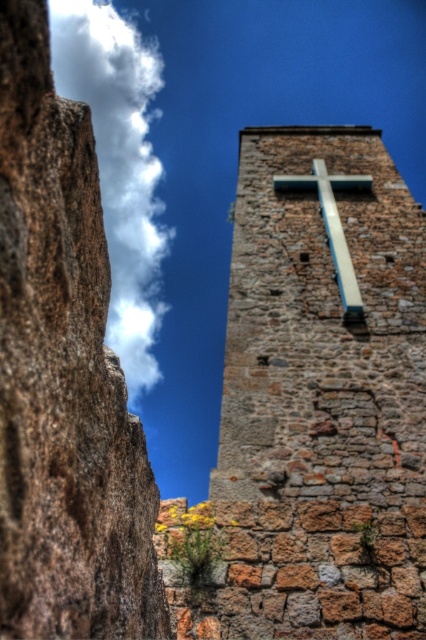
Locate an element on the screen. This screenshot has height=640, width=426. rustic stone cross at upper center is located at coordinates (319, 314).

Does rustic stone cross at upper center have a smaller size compared to white fluffy cloud at upper left?

Correct, rustic stone cross at upper center occupies less space than white fluffy cloud at upper left.

Does point (233, 476) come in front of point (138, 182)?

That is True.

Find the location of a particular element. rustic stone cross at upper center is located at coordinates 319,314.

Between rustic stone cross at upper center and metallic silver cross at center, which one has more height?

With more height is rustic stone cross at upper center.

Is rustic stone cross at upper center shorter than metallic silver cross at center?

Incorrect, rustic stone cross at upper center's height does not fall short of metallic silver cross at center's.

Is point (282, 184) more distant than point (294, 182)?

That is False.

The image size is (426, 640). I want to click on rustic stone cross at upper center, so click(x=319, y=314).

Between white fluffy cloud at upper left and metallic silver cross at center, which one is positioned higher?

Positioned higher is white fluffy cloud at upper left.

Can you confirm if white fluffy cloud at upper left is positioned to the left of metallic silver cross at center?

Correct, you'll find white fluffy cloud at upper left to the left of metallic silver cross at center.

Is point (118, 177) more distant than point (340, 292)?

Yes.

The image size is (426, 640). I want to click on white fluffy cloud at upper left, so click(120, 164).